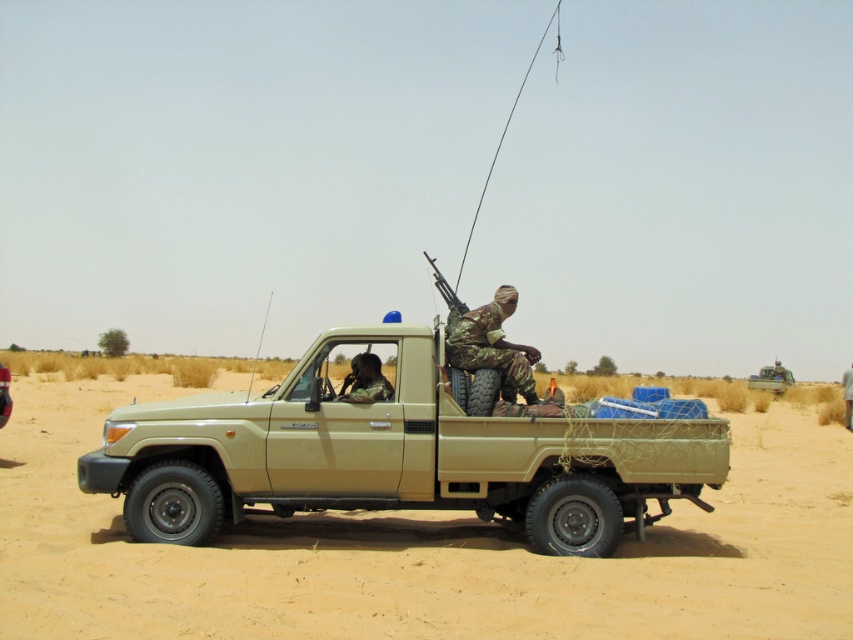
Which is in front, point (526, 392) or point (376, 365)?

Positioned in front is point (376, 365).

Between point (479, 321) and point (381, 376), which one is positioned behind?

The point (479, 321) is behind.

The image size is (853, 640). I want to click on camouflage fabric uniform at center, so click(x=492, y=346).

Can you confirm if matte khaki truck at center is thinner than camouflage fabric helmet at center?

Correct, matte khaki truck at center's width is less than camouflage fabric helmet at center's.

Does matte khaki truck at center come behind camouflage fabric helmet at center?

Yes, it is.

Identify the location of matte khaki truck at center. This screenshot has width=853, height=640. (393, 454).

Is sandy beige dirt field at center to the left of camouflage fabric uniform at center from the viewer's perspective?

In fact, sandy beige dirt field at center is to the right of camouflage fabric uniform at center.

Does point (258, 515) come farther from viewer compared to point (450, 358)?

Yes, point (258, 515) is farther from viewer.

Who is more forward, (471,588) or (471,330)?

Point (471,588) is in front.

Locate an element on the screen. This screenshot has height=640, width=853. sandy beige dirt field at center is located at coordinates (421, 550).